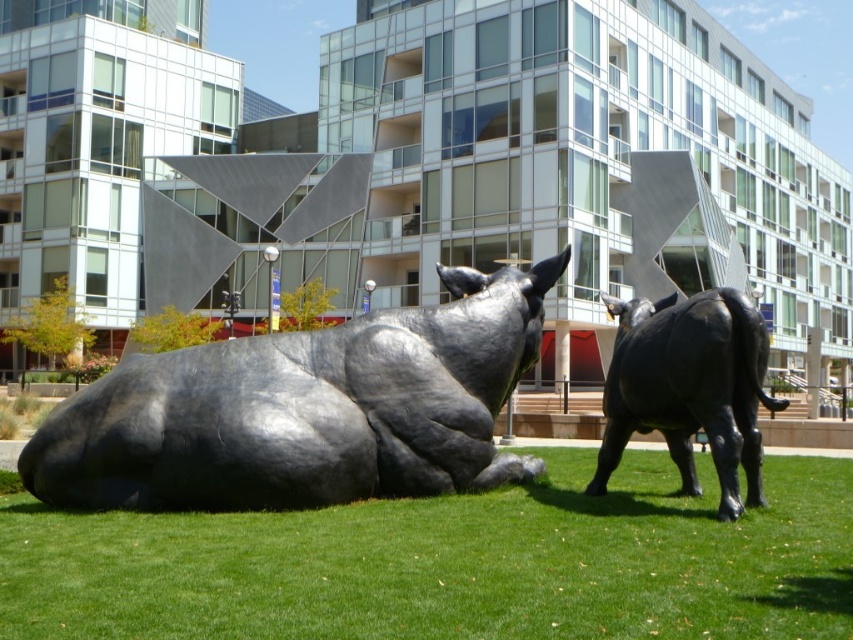
The width and height of the screenshot is (853, 640). Identify the location of polished black bull at center. (305, 410).

Is point (194, 432) in front of point (686, 356)?

No, it is behind (686, 356).

You are a GUI agent. You are given a task and a screenshot of the screen. Output one action in this format:
    pyautogui.click(x=<x>, y=<y>)
    Task: Click on the polished black bull at center
    This screenshot has width=853, height=640.
    Given the screenshot: What is the action you would take?
    305,410